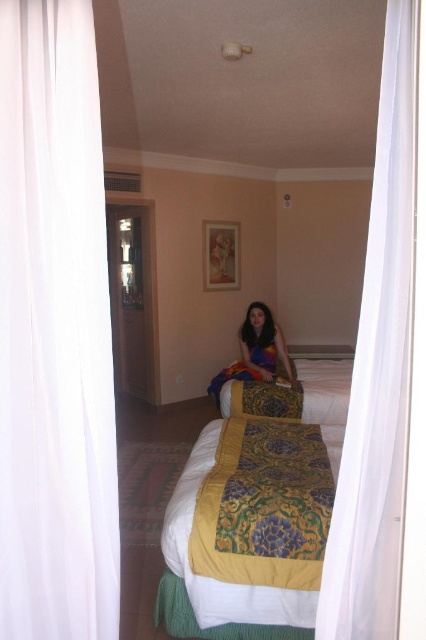
You are a guest entering the bedroom and want to see the view outside through the window. The white sheer curtain at left and the multicolored fabric at center are in your way. Which object should you move to get a clear view?

You should move the white sheer curtain at left because it is positioned over the multicolored fabric at center, meaning the curtain is closer to the window and blocking the view.

You are trying to decide which item to use for a craft project. You need something large enough to cover a small table. Based on the scene, which object between the white sheer curtain at left and the multicolored fabric at center would be more suitable for covering the table?

The multicolored fabric at center is larger than the white sheer curtain at left, so it would be more suitable for covering the table.

You are standing in the bedroom and want to move from point A to point B. Point A is at coordinates point (x=43, y=120) and point B is at coordinates point (x=173, y=500). Which direction should you face to walk towards point B from point A?

You should face towards the right and slightly forward direction to walk from point A to point B since point A is in front of point B.